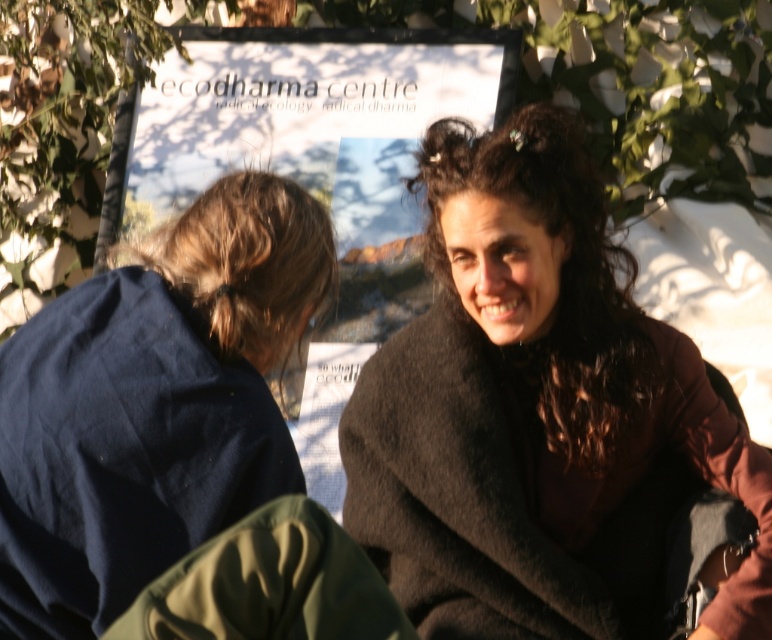
Question: Which of these objects is positioned farthest from the white paper poster at center?

Choices:
 (A) brown woolen coat at center
 (B) dark brown fur coat at center

Answer: (A)

Question: In this image, where is brown fuzzy blanket at upper right located relative to dark brown fur coat at center?

Choices:
 (A) above
 (B) below

Answer: (B)

Question: Among these objects, which one is farthest from the camera?

Choices:
 (A) brown hair at left
 (B) brown woolen coat at center

Answer: (B)

Question: Does brown woolen coat at center have a smaller size compared to brown fuzzy blanket at upper right?

Choices:
 (A) no
 (B) yes

Answer: (A)

Question: Based on their relative distances, which object is nearer to the brown fuzzy blanket at upper right?

Choices:
 (A) brown woolen coat at center
 (B) brown hair at left
 (C) white paper poster at center

Answer: (B)

Question: Is brown woolen coat at center positioned before brown hair at left?

Choices:
 (A) no
 (B) yes

Answer: (A)